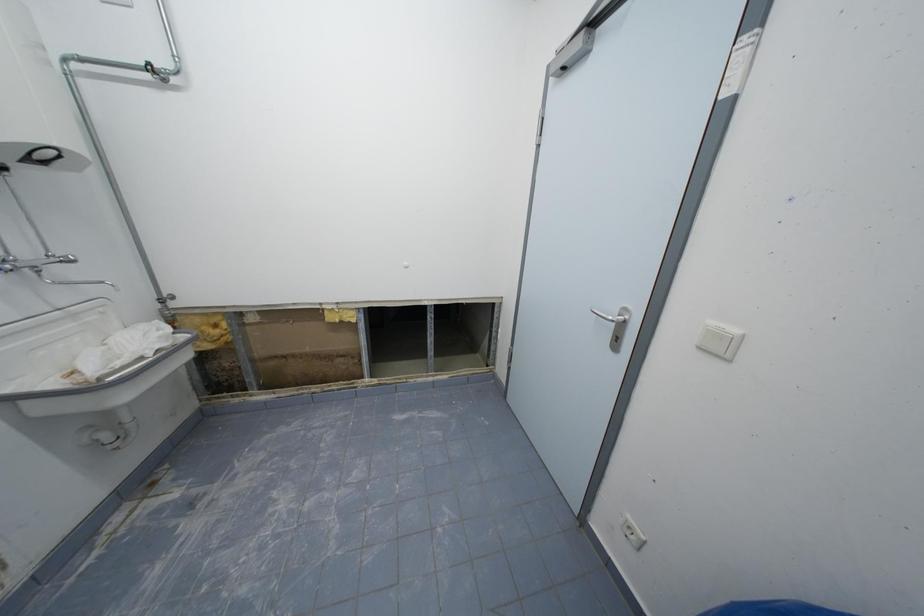
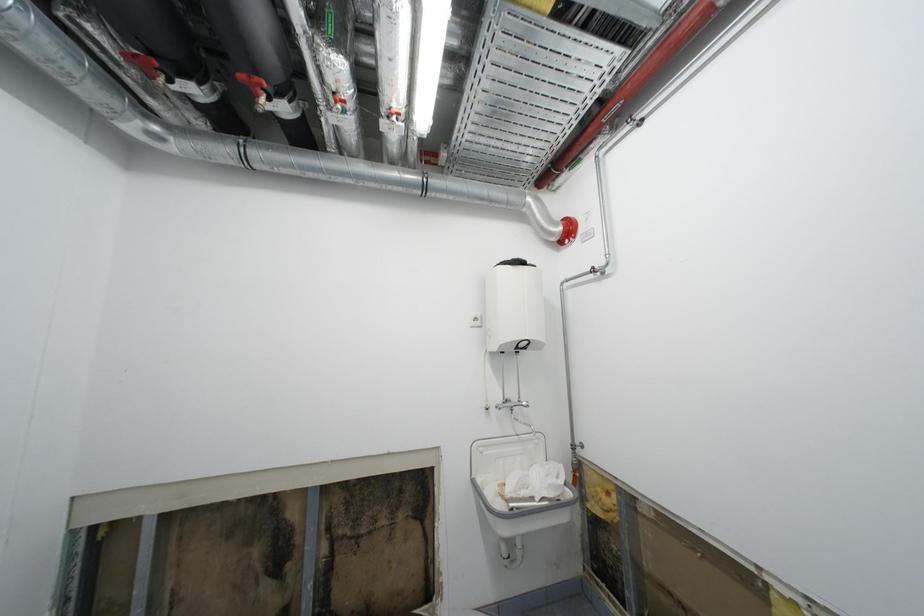
Question: The images are taken continuously from a first-person perspective. In which direction is your viewpoint rotating?

Choices:
 (A) Left
 (B) Right
 (C) Up
 (D) Down

Answer: (A)